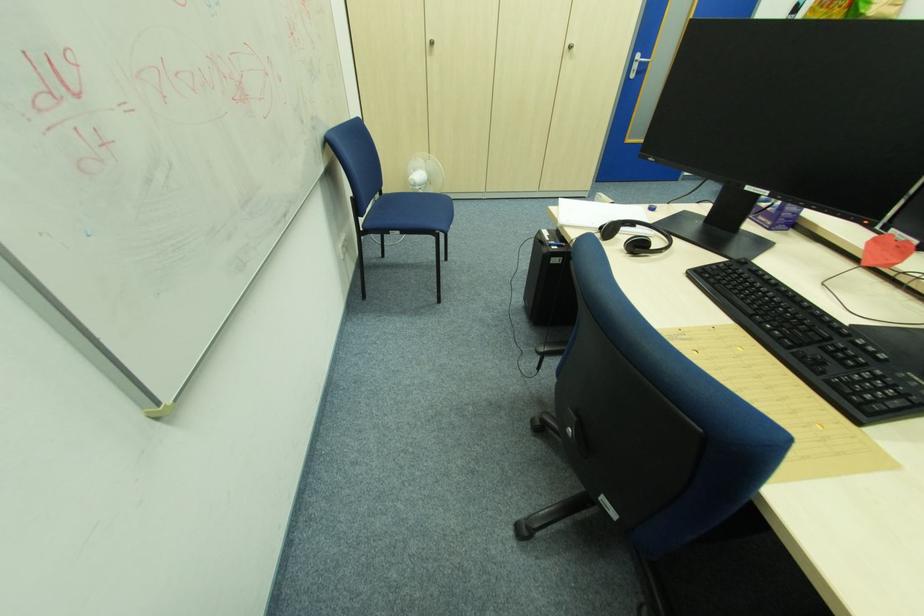
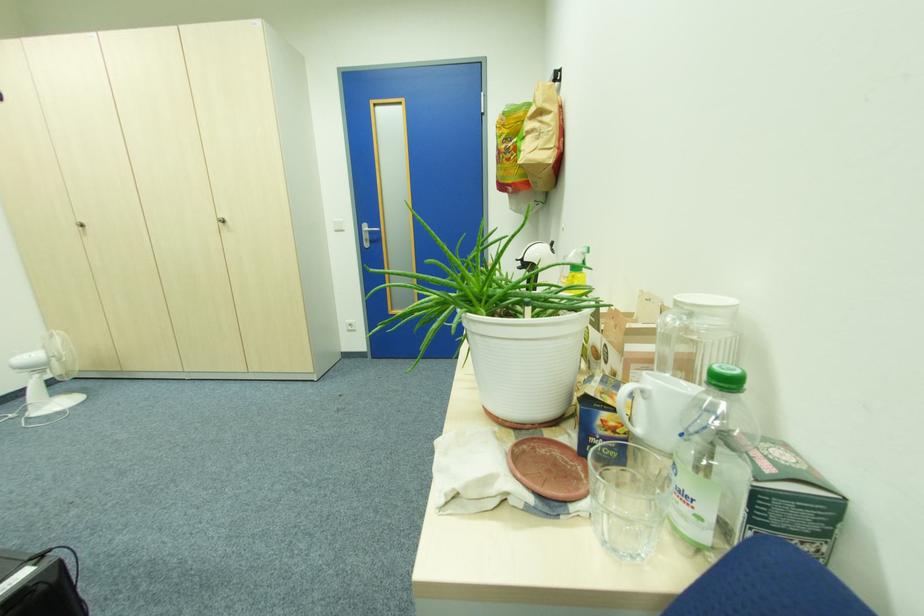
In a continuous first-person perspective shot, in which direction is the camera moving?

The cameraman moved toward right, forward.